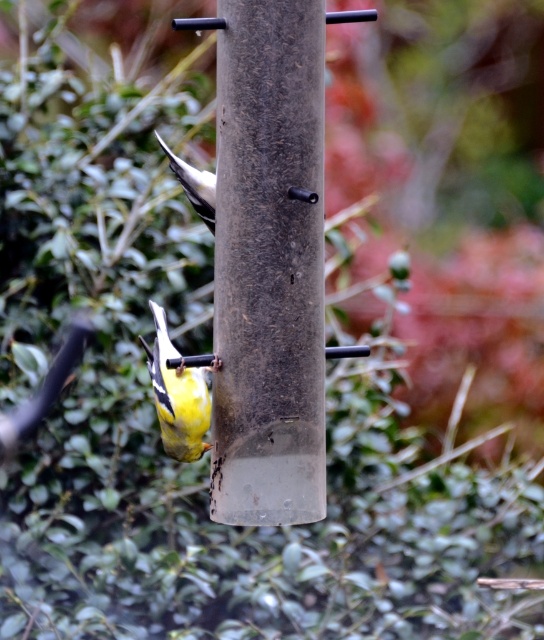
Who is shorter, smooth brown pole at center or yellow and black feathers at center?

yellow and black feathers at center

Which is in front, point (246, 150) or point (181, 157)?

Positioned in front is point (246, 150).

Between point (251, 305) and point (183, 192), which one is positioned behind?

The point (183, 192) is more distant.

Image resolution: width=544 pixels, height=640 pixels. Find the location of `smooth brown pole at center`. smooth brown pole at center is located at coordinates (268, 264).

Which is below, yellow matte bird at center or yellow and black feathers at center?

Positioned lower is yellow matte bird at center.

Which of these two, yellow matte bird at center or yellow and black feathers at center, stands shorter?

yellow and black feathers at center is shorter.

This screenshot has height=640, width=544. What do you see at coordinates (177, 396) in the screenshot?
I see `yellow matte bird at center` at bounding box center [177, 396].

You are a GUI agent. You are given a task and a screenshot of the screen. Output one action in this format:
    pyautogui.click(x=<x>, y=<y>)
    Task: Click on the yellow matte bird at center
    This screenshot has width=544, height=640.
    Given the screenshot: What is the action you would take?
    pyautogui.click(x=177, y=396)

Does smooth brown pole at center have a greater width compared to yellow matte bird at center?

Yes, smooth brown pole at center is wider than yellow matte bird at center.

Can you confirm if smooth brown pole at center is thinner than yellow matte bird at center?

Incorrect, smooth brown pole at center's width is not less than yellow matte bird at center's.

Who is more distant from viewer, (268,291) or (200,435)?

The point (200,435) is behind.

The image size is (544, 640). I want to click on smooth brown pole at center, so click(x=268, y=264).